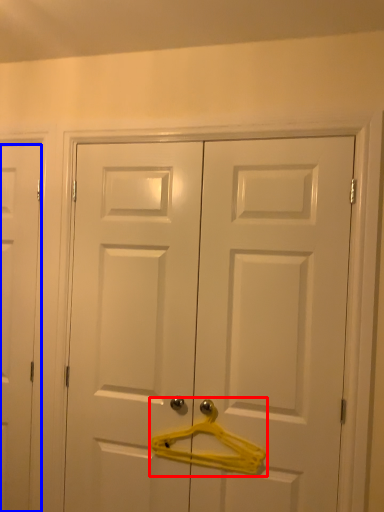
Question: Which of the following is the farthest to the observer, hanger (highlighted by a red box) or door (highlighted by a blue box)?

Choices:
 (A) hanger
 (B) door

Answer: (B)